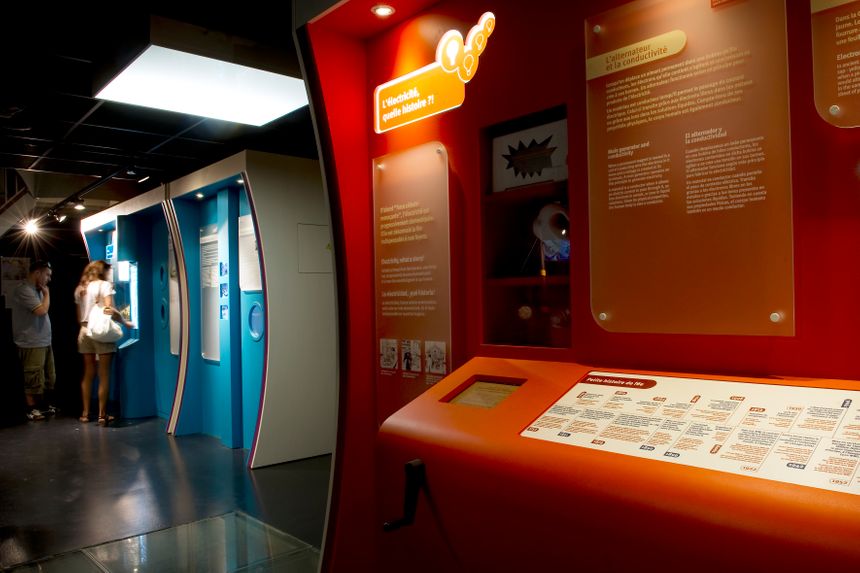
At what (x,y) coordinates should I click in order to perform the action: click on floor. Please return your answer as a coordinate pair (x, y). Looking at the image, I should click on (226, 535).